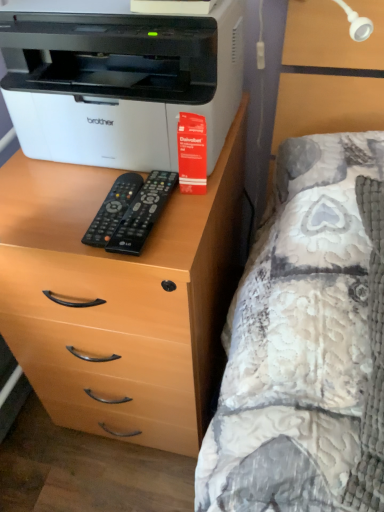
Question: Can you confirm if black plastic remote at center, the second remote viewed from the left, is smaller than black plastic remote at center, arranged as the first remote when viewed from the left?

Choices:
 (A) yes
 (B) no

Answer: (B)

Question: Does black plastic remote at center, the second remote viewed from the left, have a greater width compared to black plastic remote at center, arranged as the second remote when viewed from the right?

Choices:
 (A) no
 (B) yes

Answer: (B)

Question: Is black plastic remote at center, the second remote viewed from the left, next to black plastic remote at center, arranged as the second remote when viewed from the right, and touching it?

Choices:
 (A) no
 (B) yes

Answer: (B)

Question: Does black plastic remote at center, the second remote viewed from the left, lie behind black plastic remote at center, arranged as the first remote when viewed from the left?

Choices:
 (A) no
 (B) yes

Answer: (A)

Question: Considering the relative sizes of black plastic remote at center, the second remote viewed from the left, and black plastic remote at center, arranged as the second remote when viewed from the right, in the image provided, is black plastic remote at center, the second remote viewed from the left, shorter than black plastic remote at center, arranged as the second remote when viewed from the right,?

Choices:
 (A) yes
 (B) no

Answer: (B)

Question: Is black plastic remote at center, the second remote viewed from the left, taller than black plastic remote at center, arranged as the first remote when viewed from the left?

Choices:
 (A) yes
 (B) no

Answer: (A)

Question: From a real-world perspective, is light brown wood chest of drawers at left beneath fluffy quilted bed at right?

Choices:
 (A) no
 (B) yes

Answer: (B)

Question: Would you say light brown wood chest of drawers at left is a long distance from fluffy quilted bed at right?

Choices:
 (A) no
 (B) yes

Answer: (A)

Question: Is light brown wood chest of drawers at left to the left of fluffy quilted bed at right from the viewer's perspective?

Choices:
 (A) no
 (B) yes

Answer: (B)

Question: Does light brown wood chest of drawers at left have a greater height compared to fluffy quilted bed at right?

Choices:
 (A) yes
 (B) no

Answer: (A)

Question: From the image's perspective, is light brown wood chest of drawers at left located beneath fluffy quilted bed at right?

Choices:
 (A) yes
 (B) no

Answer: (B)

Question: From a real-world perspective, is light brown wood chest of drawers at left on top of fluffy quilted bed at right?

Choices:
 (A) no
 (B) yes

Answer: (A)

Question: Is fluffy quilted bed at right thinner than black plastic remote at center, the second remote viewed from the left?

Choices:
 (A) no
 (B) yes

Answer: (A)